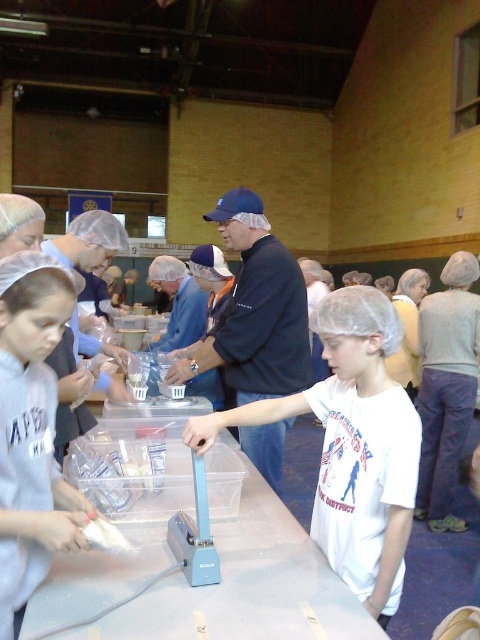
Is the position of white fabric hairnet at left more distant than that of blue fabric shirt at center?

No, it is in front of blue fabric shirt at center.

Between point (60, 292) and point (63, 260), which one is positioned in front?

Positioned in front is point (60, 292).

Locate an element on the screen. The width and height of the screenshot is (480, 640). white fabric hairnet at left is located at coordinates (32, 433).

In the scene shown: Is white matte shirt at center positioned at the back of blue fabric shirt at center?

That is False.

Who is more distant from viewer, (250, 419) or (67, 266)?

The point (67, 266) is more distant.

Find the location of a particular element. white matte shirt at center is located at coordinates (351, 444).

Locate an element on the screen. white matte shirt at center is located at coordinates (351, 444).

In the scene shown: Can you confirm if dark blue cap at center is wider than blue fabric shirt at center?

Yes.

Looking at this image, does dark blue cap at center have a lesser width compared to blue fabric shirt at center?

No, dark blue cap at center is not thinner than blue fabric shirt at center.

This screenshot has width=480, height=640. Find the location of `dark blue cap at center`. dark blue cap at center is located at coordinates (254, 310).

Image resolution: width=480 pixels, height=640 pixels. What are the coordinates of `dark blue cap at center` in the screenshot? It's located at (254, 310).